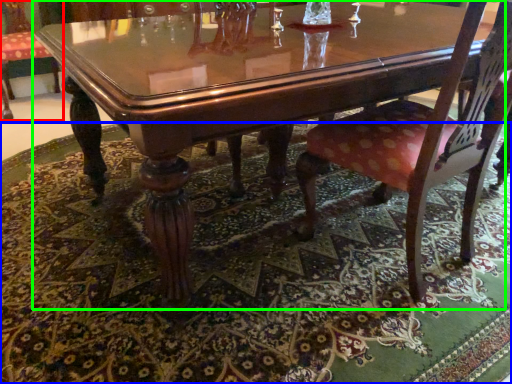
Question: Which object is positioned farthest from chair (highlighted by a red box)? Select from place mat (highlighted by a blue box) and coffee table (highlighted by a green box).

Choices:
 (A) place mat
 (B) coffee table

Answer: (B)